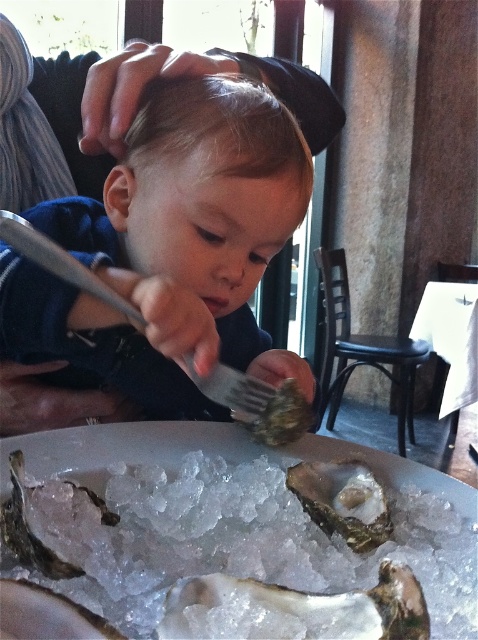
Is translucent white shell at center behind shiny silver oyster at lower left?

That is False.

Who is lower down, translucent white shell at center or shiny silver oyster at lower left?

translucent white shell at center is lower down.

What do you see at coordinates (295, 609) in the screenshot?
I see `translucent white shell at center` at bounding box center [295, 609].

The height and width of the screenshot is (640, 478). I want to click on translucent white shell at center, so click(x=295, y=609).

Is point (75, 509) behind point (101, 632)?

Yes, point (75, 509) is behind point (101, 632).

From the picture: Which of these two, white pearl oyster at center or shiny pearl oyster at lower left, stands shorter?

shiny pearl oyster at lower left

You are a GUI agent. You are given a task and a screenshot of the screen. Output one action in this format:
    pyautogui.click(x=<x>, y=<y>)
    Task: Click on the white pearl oyster at center
    
    Given the screenshot: What is the action you would take?
    pyautogui.click(x=294, y=609)

Does translucent white shell at center have a smaller size compared to shiny pearl oyster at lower left?

No.

Who is more distant from viewer, (249,604) or (83,628)?

Point (249,604)

Does point (341, 605) lie in front of point (46, 632)?

No, it is behind (46, 632).

Locate an element on the screen. The image size is (478, 640). translucent white shell at center is located at coordinates (295, 609).